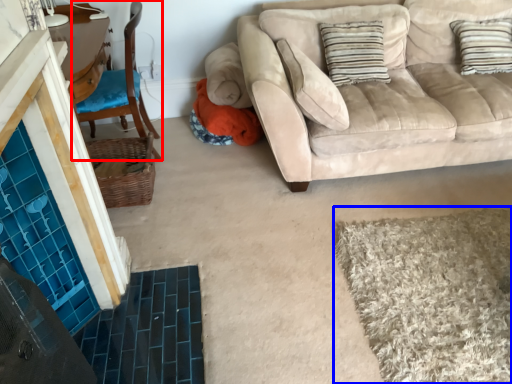
Question: Which object is closer to the camera taking this photo, chair (highlighted by a red box) or bath mat (highlighted by a blue box)?

Choices:
 (A) chair
 (B) bath mat

Answer: (B)